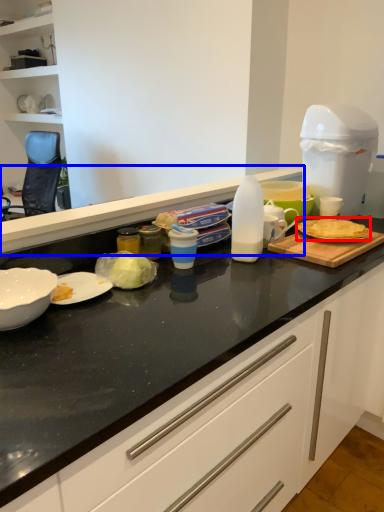
Question: Which object is closer to the camera taking this photo, food (highlighted by a red box) or countertop (highlighted by a blue box)?

Choices:
 (A) food
 (B) countertop

Answer: (B)